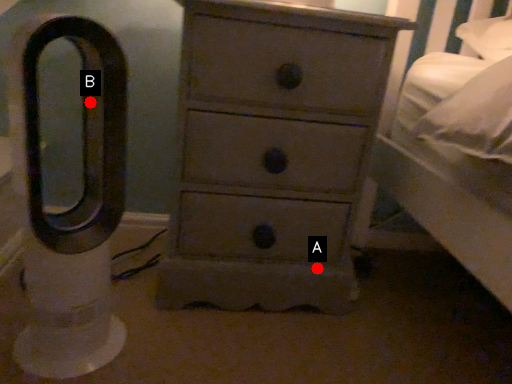
Question: Two points are circled on the image, labeled by A and B beside each circle. Which point is further to the camera?

Choices:
 (A) A is further
 (B) B is further

Answer: (A)